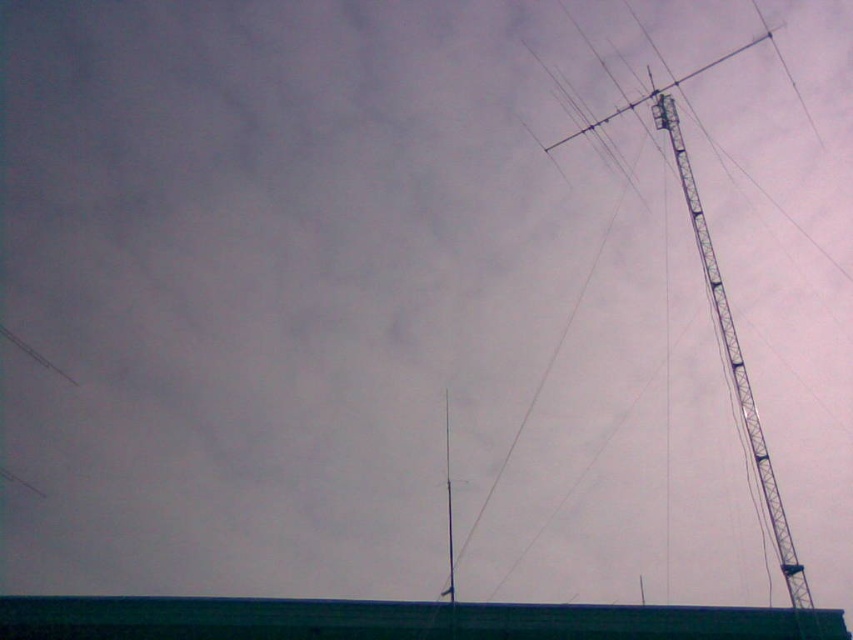
You are a maintenance worker needing to reach both the metallic tower at right and the metallic pole at center. Which object should you approach first if you start from the left side of the image?

You should approach the metallic pole at center first because it is located to the left of the metallic tower at right.